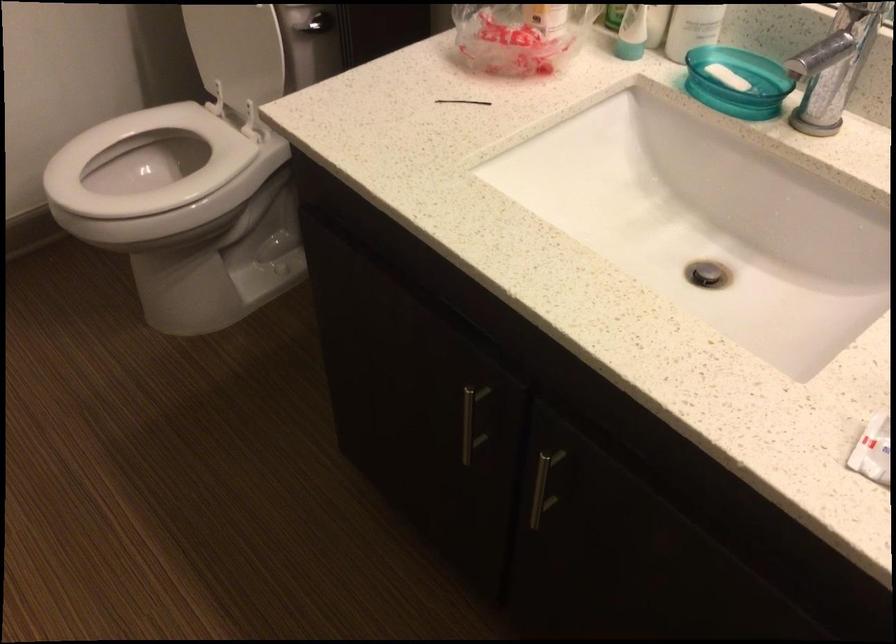
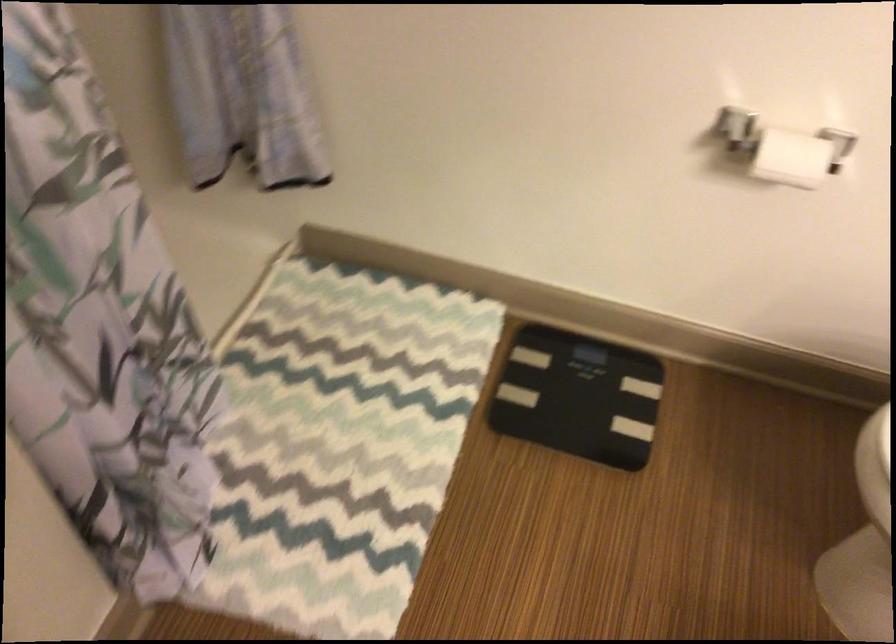
Question: The camera is either moving clockwise (left) or counter-clockwise (right) around the object. The first image is from the beginning of the video and the second image is from the end. Is the camera moving left or right when shooting the video?

Choices:
 (A) Left
 (B) Right

Answer: (B)